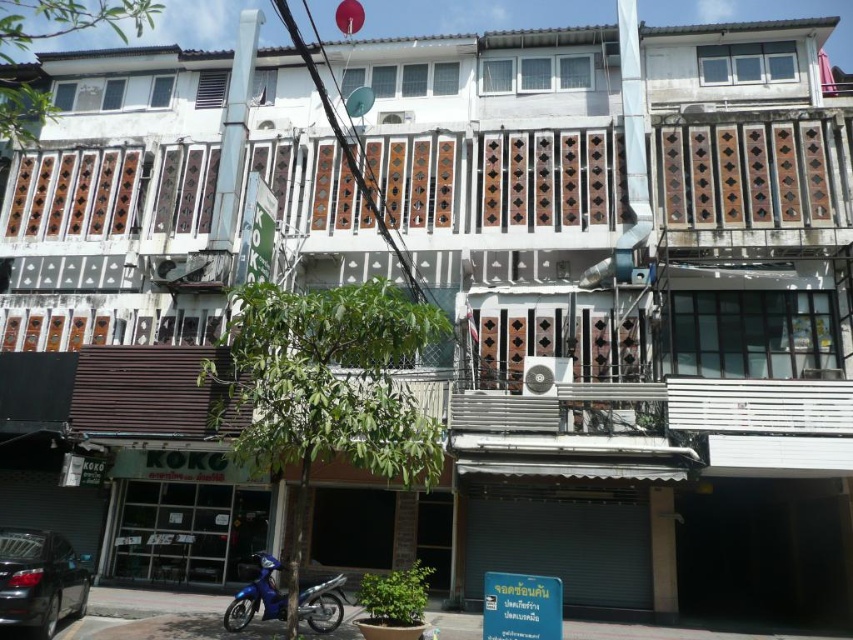
Question: Is shiny black car at lower left closer to the viewer compared to blue matte motorcycle at lower left?

Choices:
 (A) yes
 (B) no

Answer: (A)

Question: Is shiny black car at lower left positioned behind blue matte motorcycle at lower left?

Choices:
 (A) no
 (B) yes

Answer: (A)

Question: Which point is farther from the camera taking this photo?

Choices:
 (A) (22, 624)
 (B) (334, 611)

Answer: (B)

Question: Is shiny black car at lower left thinner than blue matte motorcycle at lower left?

Choices:
 (A) no
 (B) yes

Answer: (B)